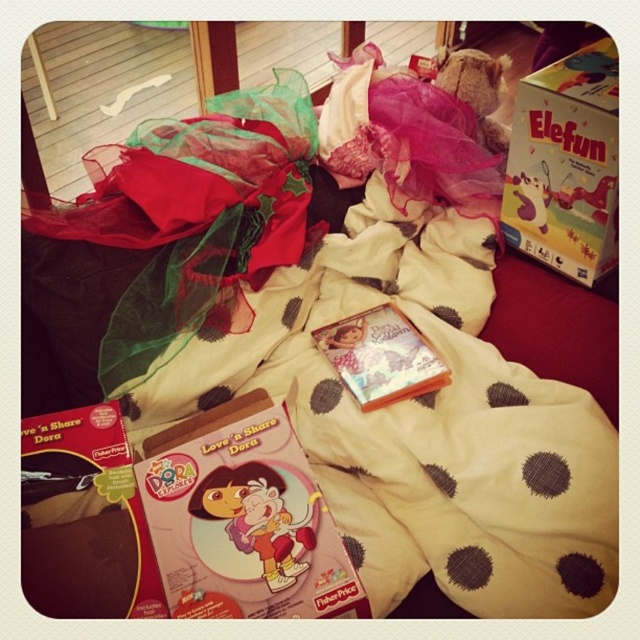
You are organizing a toy storage area and need to place the matte cardboard box at upper right and the matte cardboard box at center into a shelf that can only accommodate items up to 12 inches in width. Based on the scene description, can both boxes fit side by side on the shelf?

The matte cardboard box at upper right might be wider than the matte cardboard box at center, so it is uncertain if both can fit side by side on the 12 inch shelf without exceeding the total width limit.

In the scene shown: You are organizing a toy storage area and need to place both the matte cardboard box at upper right and the matte cardboard box at center into a storage bin. Which box should you place first if you want to maximize space efficiency?

The matte cardboard box at upper right is bigger than the matte cardboard box at center, so you should place the matte cardboard box at upper right first to maximize space efficiency by fitting larger items first.

What is located at the point with coordinates (564, 164)?

The point at (564, 164) has a matte cardboard box at upper right.